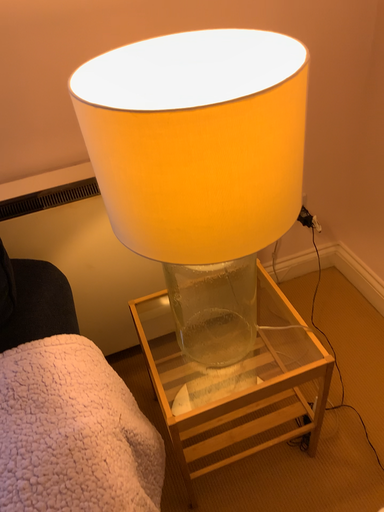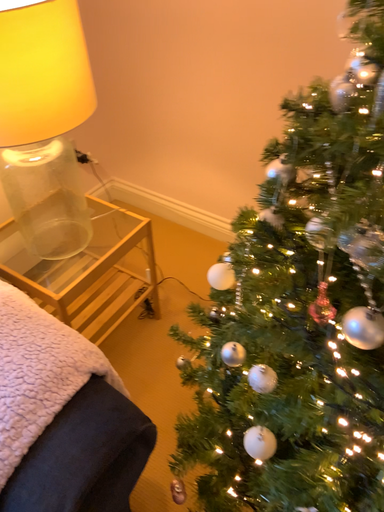
Question: How did the camera likely rotate when shooting the video?

Choices:
 (A) rotated upward
 (B) rotated downward

Answer: (A)